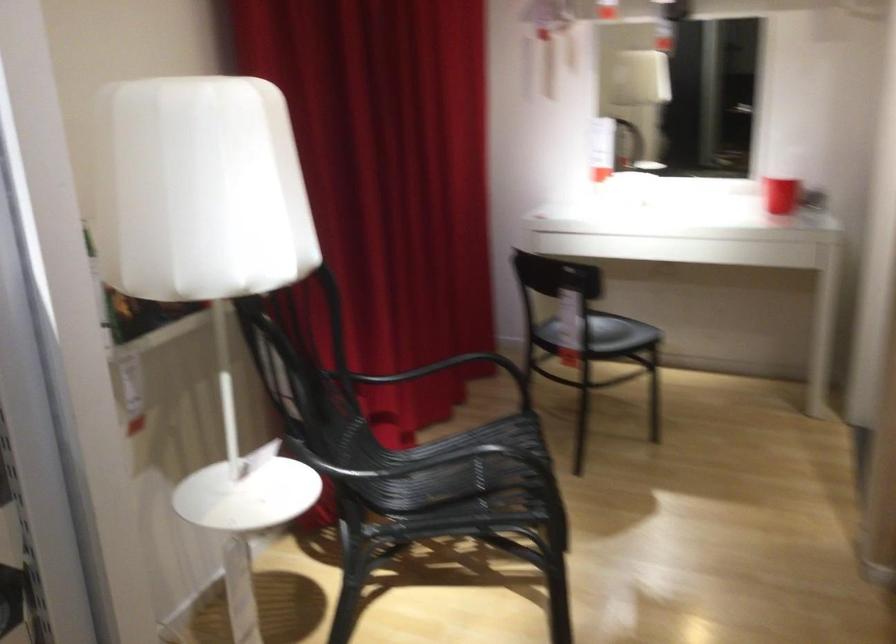
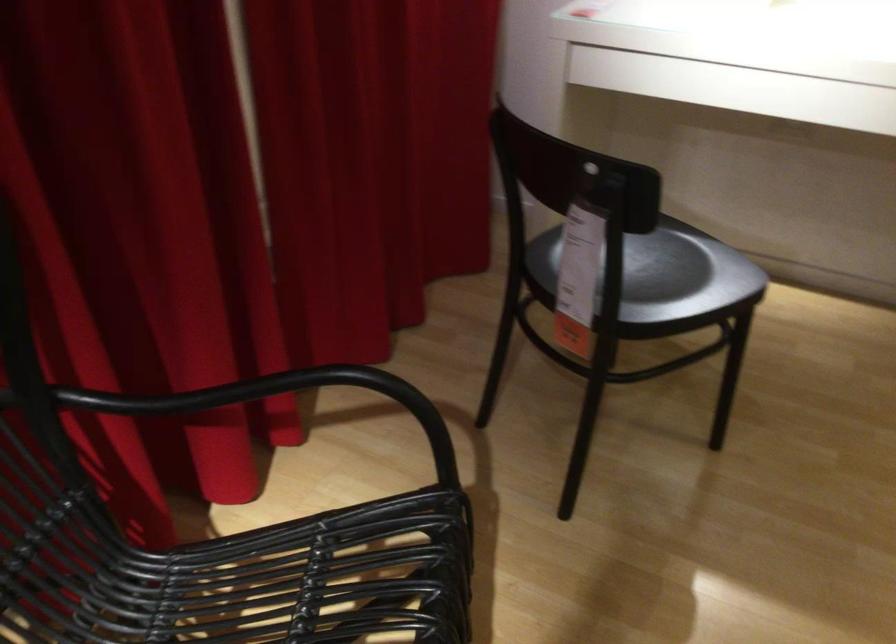
Where in the second image is the point corresponding to (x=443, y=373) from the first image?

(259, 395)